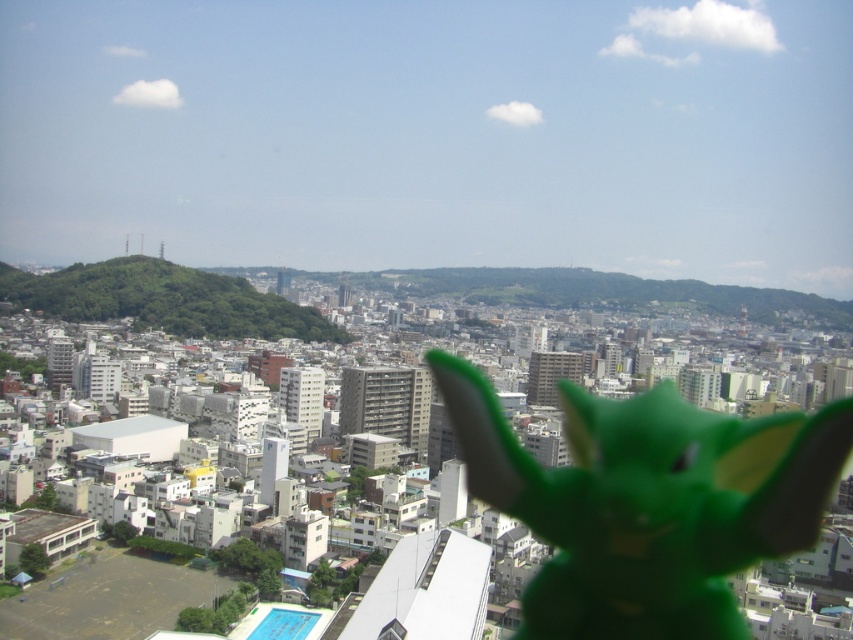
Locate an element on the screen. green matte toy at center is located at coordinates (647, 502).

From the picture: Who is more distant from viewer, [647,486] or [144,291]?

The point [144,291] is behind.

Between point (569, 384) and point (231, 296), which one is positioned in front?

Point (569, 384) is more forward.

Locate an element on the screen. Image resolution: width=853 pixels, height=640 pixels. green matte toy at center is located at coordinates (647, 502).